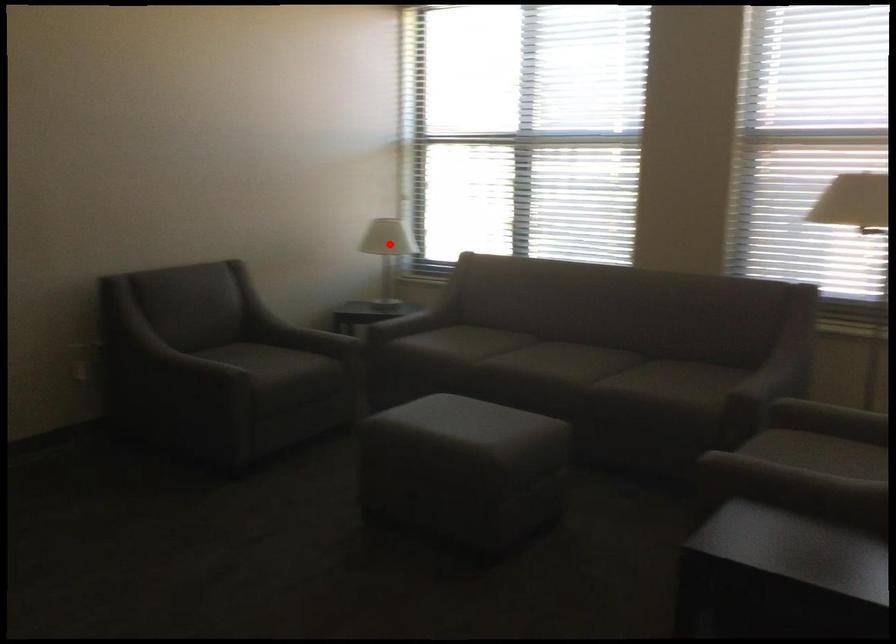
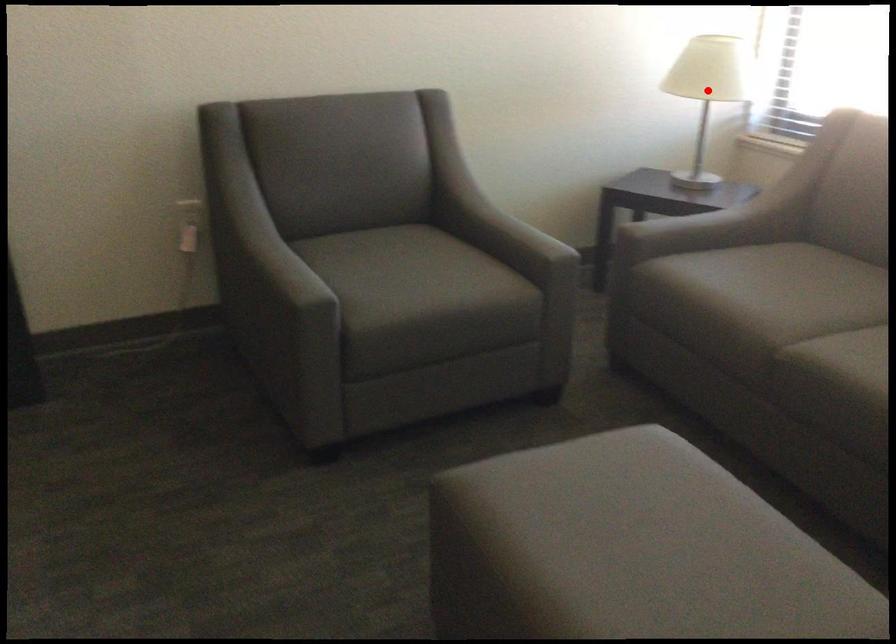
I am providing you with two images of the same scene from different viewpoints. A red point is marked on the first image and another point is marked on the second image. Does the point marked in image1 correspond to the same location as the one in image2?

Yes